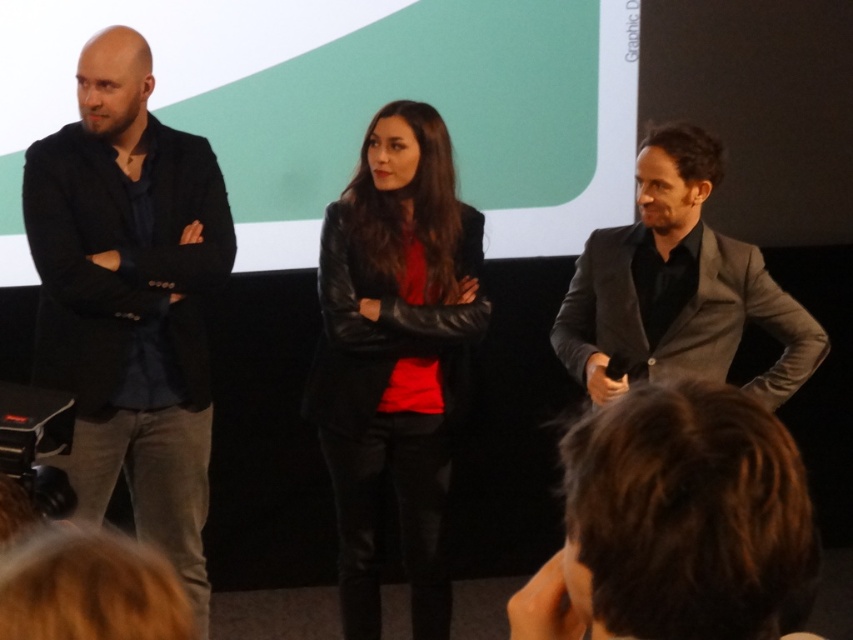
Question: Which object is positioned closest to the black leather jacket at left?

Choices:
 (A) leather jacket at center
 (B) gray wool suit at right
 (C) dark brown hair at center

Answer: (A)

Question: Based on their relative distances, which object is farther from the leather jacket at center?

Choices:
 (A) dark brown hair at center
 (B) gray wool suit at right
 (C) black leather jacket at left

Answer: (A)

Question: Which of the following is the closest to the observer?

Choices:
 (A) gray wool suit at right
 (B) leather jacket at center

Answer: (A)

Question: Can you confirm if leather jacket at center is smaller than dark brown hair at center?

Choices:
 (A) no
 (B) yes

Answer: (A)

Question: Can you confirm if black leather jacket at left is positioned above gray wool suit at right?

Choices:
 (A) yes
 (B) no

Answer: (B)

Question: Does leather jacket at center appear over dark brown hair at center?

Choices:
 (A) yes
 (B) no

Answer: (A)